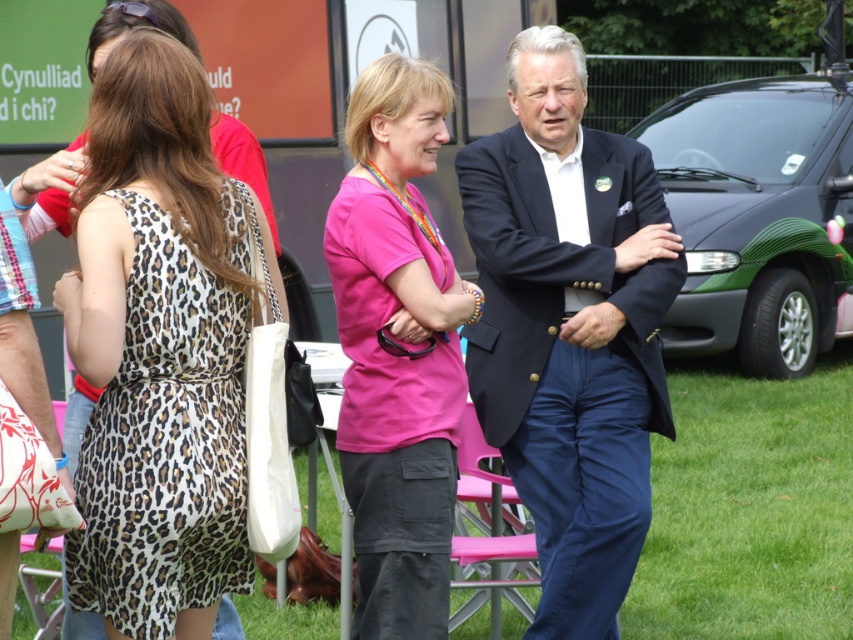
Question: Is leopard print dress at left closer to camera compared to pink fabric shirt at center?

Choices:
 (A) no
 (B) yes

Answer: (B)

Question: Based on their relative distances, which object is nearer to the navy blue suit at center?

Choices:
 (A) green grass at center
 (B) pink fabric shirt at center

Answer: (B)

Question: Estimate the real-world distances between objects in this image. Which object is closer to the navy blue suit at center?

Choices:
 (A) green grass at center
 (B) pink fabric shirt at center
 (C) leopard print dress at left

Answer: (B)

Question: Does leopard print dress at left appear on the right side of navy blue suit at center?

Choices:
 (A) no
 (B) yes

Answer: (A)

Question: Based on their relative distances, which object is nearer to the leopard print dress at left?

Choices:
 (A) green grass at center
 (B) navy blue suit at center
 (C) pink fabric shirt at center

Answer: (C)

Question: From the image, what is the correct spatial relationship of leopard print dress at left in relation to green grass at center?

Choices:
 (A) below
 (B) above

Answer: (B)